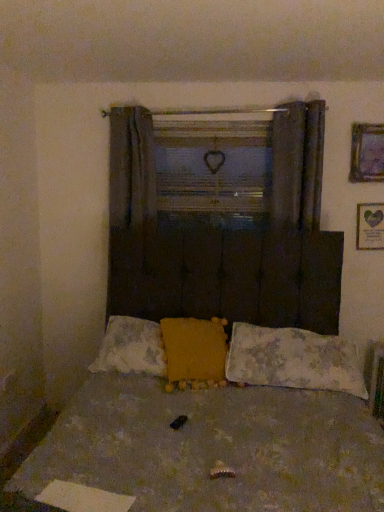
Question: Is fluffy white pillow at center, which is the first pillow in right-to-left order, beside dark gray fabric curtain at upper center?

Choices:
 (A) yes
 (B) no

Answer: (B)

Question: Does fluffy white pillow at center, which ranks as the 3th pillow in left-to-right order, come behind dark gray fabric curtain at upper center?

Choices:
 (A) no
 (B) yes

Answer: (A)

Question: Can you confirm if fluffy white pillow at center, which is the first pillow in right-to-left order, is bigger than dark gray fabric curtain at upper center?

Choices:
 (A) yes
 (B) no

Answer: (A)

Question: Could you tell me if fluffy white pillow at center, which is the first pillow in right-to-left order, is facing dark gray fabric curtain at upper center?

Choices:
 (A) no
 (B) yes

Answer: (A)

Question: Is fluffy white pillow at center, which ranks as the 3th pillow in left-to-right order, shorter than dark gray fabric curtain at upper center?

Choices:
 (A) no
 (B) yes

Answer: (B)

Question: From a real-world perspective, is wooden frame at center positioned above or below white plastic radiator at lower right?

Choices:
 (A) below
 (B) above

Answer: (B)

Question: Considering the positions of wooden frame at center and white plastic radiator at lower right in the image, is wooden frame at center wider or thinner than white plastic radiator at lower right?

Choices:
 (A) thin
 (B) wide

Answer: (A)

Question: From the image's perspective, relative to white plastic radiator at lower right, is wooden frame at center above or below?

Choices:
 (A) below
 (B) above

Answer: (B)

Question: Is point (249, 209) positioned closer to the camera than point (377, 362)?

Choices:
 (A) closer
 (B) farther

Answer: (B)

Question: Based on their positions, is green paper picture frame at upper right, which is counted as the second picture frame, starting from the top, located to the left or right of fluffy yellow pillow at center, placed as the 1th pillow when sorted from left to right?

Choices:
 (A) left
 (B) right

Answer: (B)

Question: Is green paper picture frame at upper right, which is counted as the second picture frame, starting from the top, bigger or smaller than fluffy yellow pillow at center, placed as the 1th pillow when sorted from left to right?

Choices:
 (A) small
 (B) big

Answer: (A)

Question: Considering the positions of point (374, 217) and point (125, 331), is point (374, 217) closer or farther from the camera than point (125, 331)?

Choices:
 (A) closer
 (B) farther

Answer: (B)

Question: From the image's perspective, is green paper picture frame at upper right, the 1th picture frame ordered from the bottom, located above or below fluffy yellow pillow at center, arranged as the third pillow when viewed from the right?

Choices:
 (A) above
 (B) below

Answer: (A)

Question: From a real-world perspective, is fluffy yellow pillow at center, arranged as the third pillow when viewed from the right, positioned above or below fluffy white pillow at center, which ranks as the 3th pillow in left-to-right order?

Choices:
 (A) below
 (B) above

Answer: (B)

Question: Is fluffy yellow pillow at center, arranged as the third pillow when viewed from the right, wider or thinner than fluffy white pillow at center, which ranks as the 3th pillow in left-to-right order?

Choices:
 (A) wide
 (B) thin

Answer: (B)